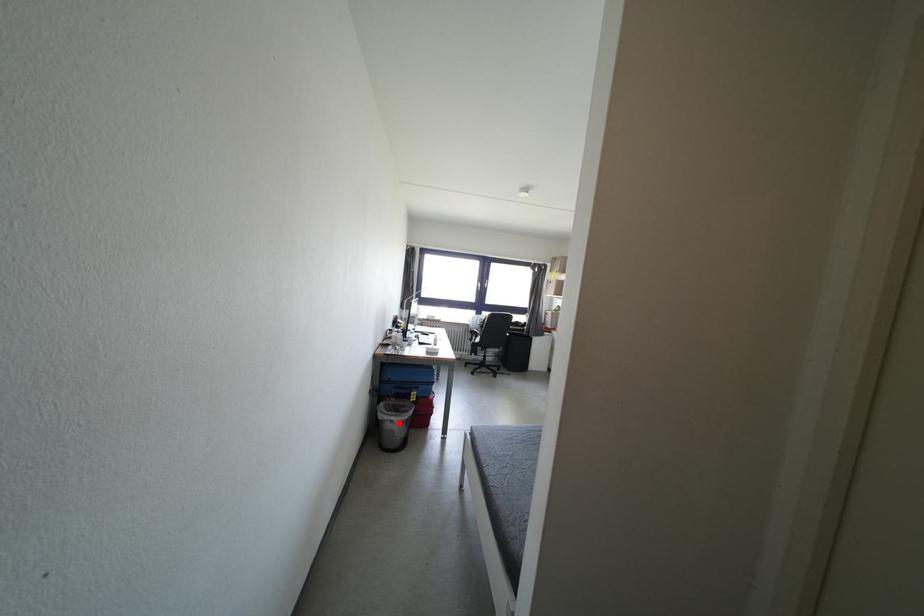
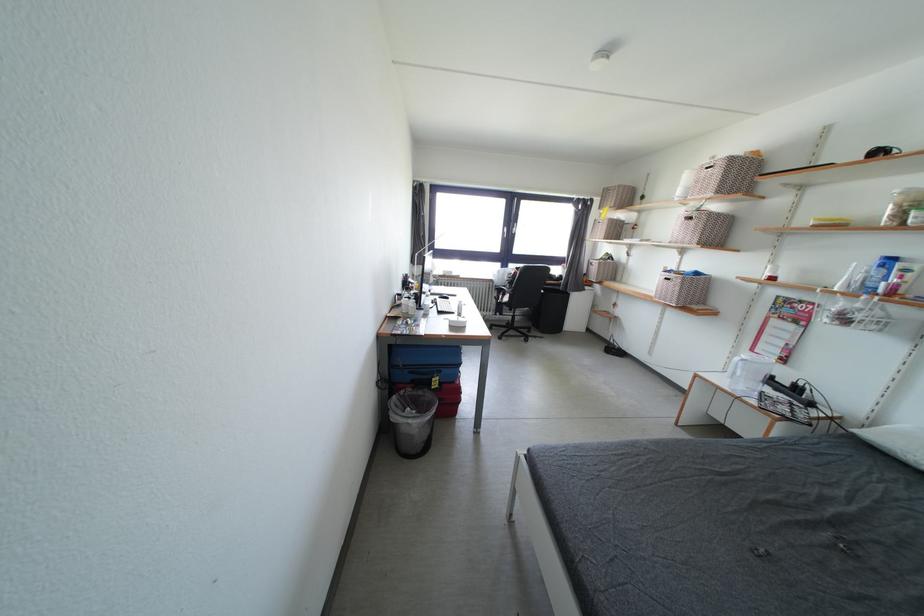
Where in the second image is the point corresponding to the highlighted location from the first image?

(417, 426)